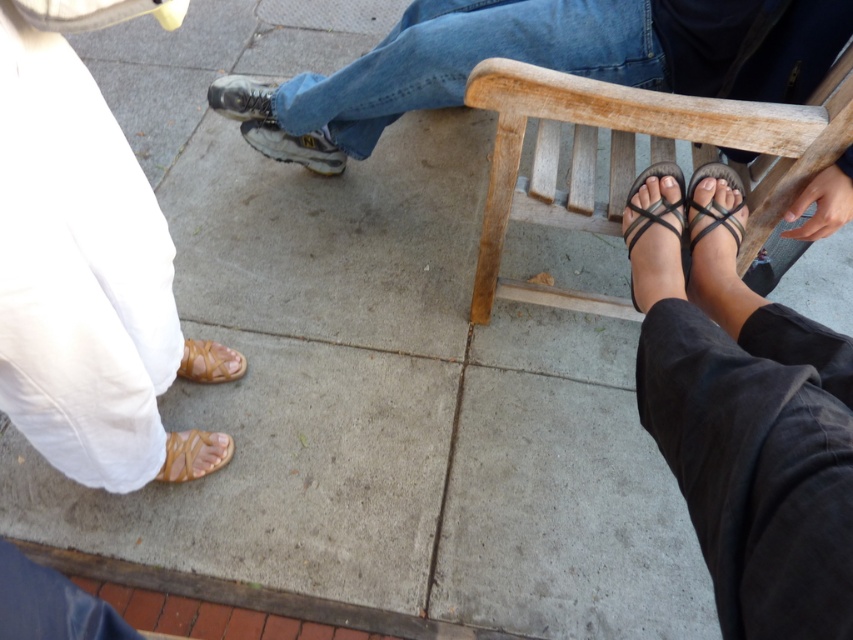
You are a delivery robot with a 30 inch wide package. You need to place it between the leather textured shoe at center and the tan leather sandal at lower left. Is there enough space?

The distance between the leather textured shoe at center and the tan leather sandal at lower left is 29.16 inches. Since the package is 30 inches wide, there isn not enough space to place it between them.

Based on the photo, you are a photographer setting up a shoot in this scene. You want to place a small prop between the matte white pants at lower left and the wooden chair at center. Based on their positions, where should you position the prop?

The prop should be placed between the matte white pants at lower left and the wooden chair at center, as the matte white pants at lower left are positioned to the left of the wooden chair at center.

You are standing in front of the wooden bench and want to place a small item between the person wearing matte white pants at lower left and the edge of the bench. Based on their position, is there enough space to place the item there?

The matte white pants at lower left is located at point (78, 257), so there is enough space to place the item between them and the edge of the bench.